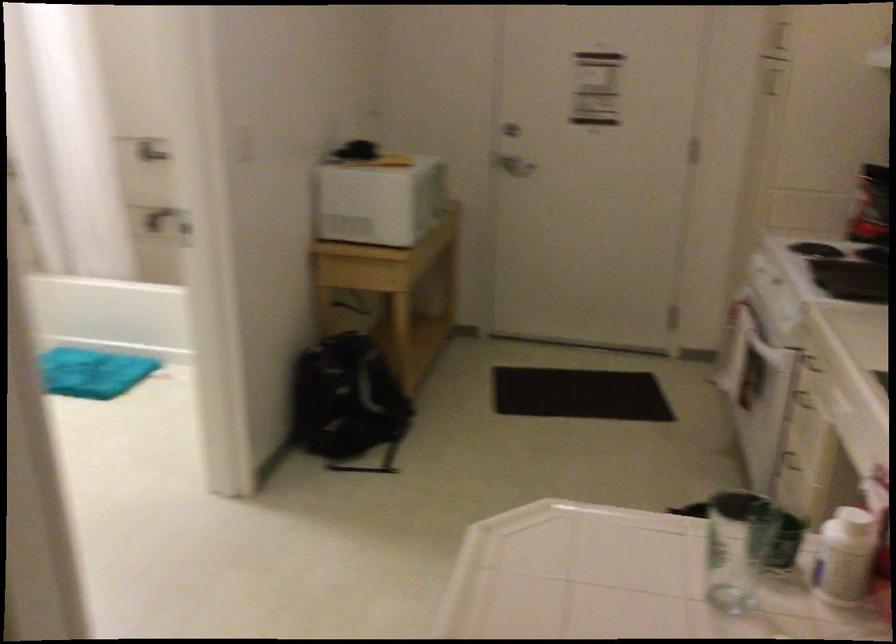
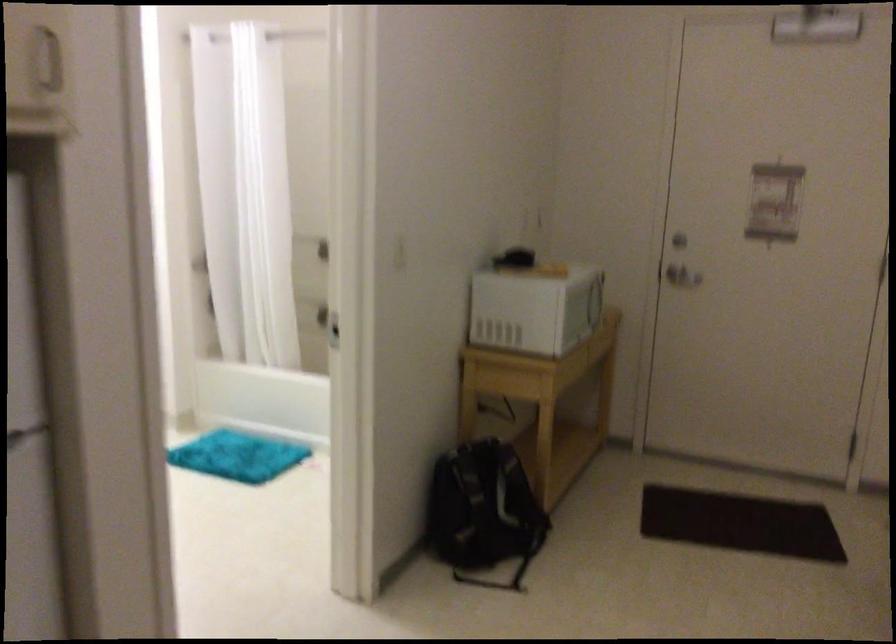
The point at (140, 216) is marked in the first image. Where is the corresponding point in the second image?

(312, 310)